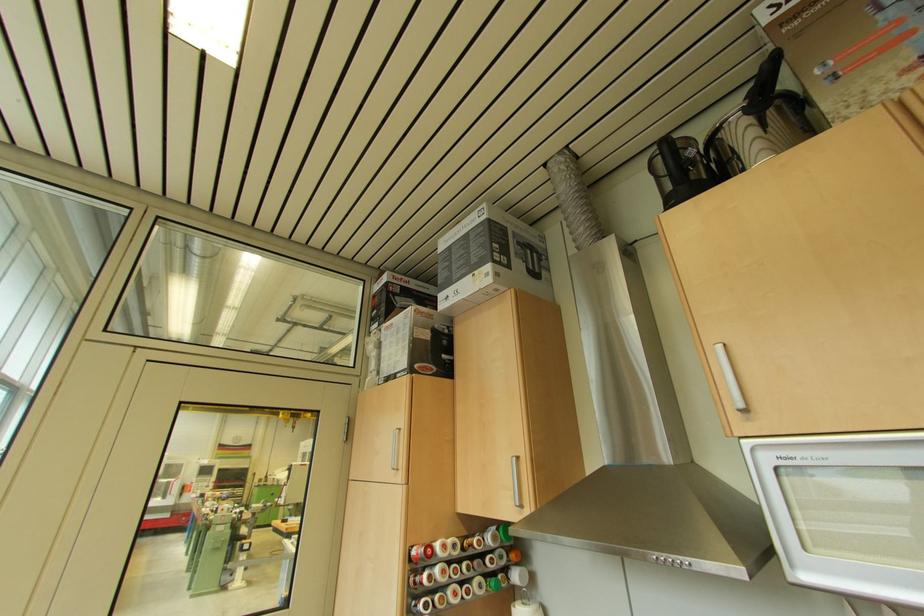
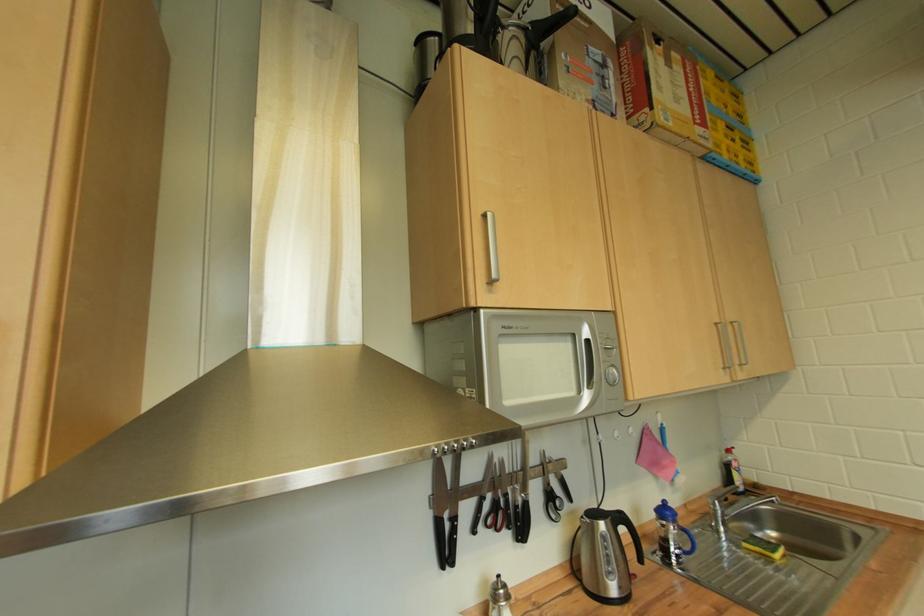
Question: How did the camera likely rotate?

Choices:
 (A) Left
 (B) Right
 (C) Up
 (D) Down

Answer: (B)